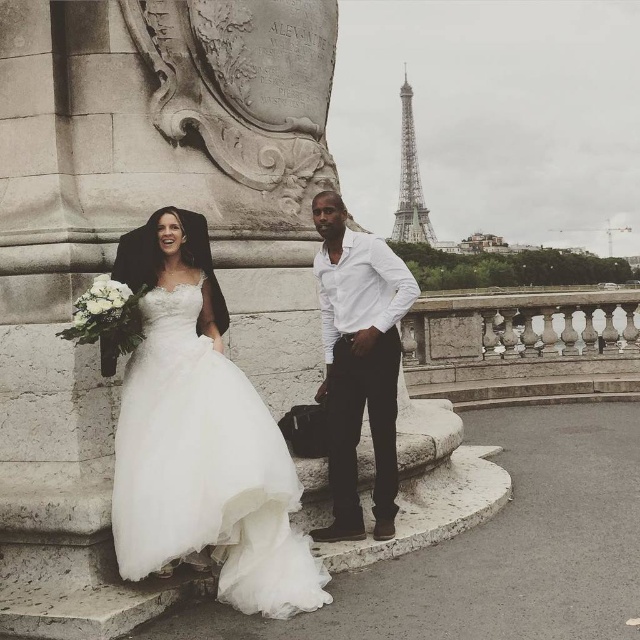
Describe the element at coordinates (358, 362) in the screenshot. I see `white smooth shirt at center` at that location.

Does white smooth shirt at center lie in front of metallic silver eiffel tower at upper right?

Yes, it is.

At what (x,y) coordinates should I click in order to perform the action: click on white smooth shirt at center. Please return your answer as a coordinate pair (x, y). The height and width of the screenshot is (640, 640). Looking at the image, I should click on (358, 362).

Based on the photo, between white tulle dress at left and white smooth shirt at center, which one is positioned higher?

Positioned higher is white smooth shirt at center.

Between point (259, 604) and point (352, 518), which one is positioned behind?

Positioned behind is point (352, 518).

The image size is (640, 640). Identify the location of white tulle dress at left. (205, 468).

Which is in front, point (202, 444) or point (404, 172)?

Point (202, 444) is more forward.

Measure the distance from white tulle dress at left to metallic silver eiffel tower at upper right.

The distance of white tulle dress at left from metallic silver eiffel tower at upper right is 327.47 meters.

Between point (196, 493) and point (424, 220), which one is positioned behind?

Point (424, 220)

I want to click on white tulle dress at left, so click(205, 468).